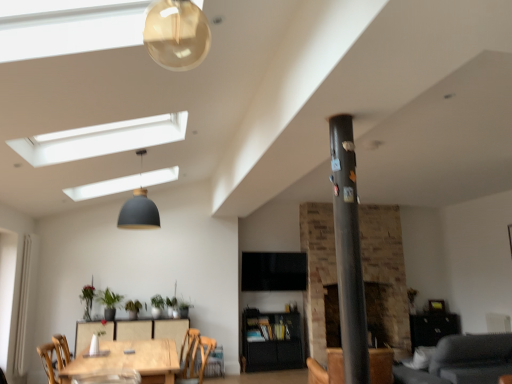
Question: From the image's perspective, is metallic gray pole at center on gray fabric couch at lower right?

Choices:
 (A) no
 (B) yes

Answer: (B)

Question: From the image's perspective, would you say metallic gray pole at center is shown under gray fabric couch at lower right?

Choices:
 (A) yes
 (B) no

Answer: (B)

Question: Can gray fabric couch at lower right be found inside metallic gray pole at center?

Choices:
 (A) no
 (B) yes

Answer: (A)

Question: Can you confirm if metallic gray pole at center is positioned to the right of gray fabric couch at lower right?

Choices:
 (A) yes
 (B) no

Answer: (B)

Question: Is metallic gray pole at center taller than gray fabric couch at lower right?

Choices:
 (A) yes
 (B) no

Answer: (A)

Question: From a real-world perspective, does metallic gray pole at center sit lower than gray fabric couch at lower right?

Choices:
 (A) no
 (B) yes

Answer: (A)

Question: Does green matte plant at lower left, positioned as the second plant in left-to-right order, appear on the right side of matte black pendant lamp at upper center?

Choices:
 (A) no
 (B) yes

Answer: (A)

Question: Is green matte plant at lower left, acting as the 3th plant starting from the right, oriented away from matte black pendant lamp at upper center?

Choices:
 (A) yes
 (B) no

Answer: (B)

Question: Is green matte plant at lower left, positioned as the second plant in left-to-right order, behind matte black pendant lamp at upper center?

Choices:
 (A) yes
 (B) no

Answer: (A)

Question: Does green matte plant at lower left, positioned as the second plant in left-to-right order, have a greater height compared to matte black pendant lamp at upper center?

Choices:
 (A) yes
 (B) no

Answer: (B)

Question: Can you confirm if green matte plant at lower left, acting as the 3th plant starting from the right, is bigger than matte black pendant lamp at upper center?

Choices:
 (A) yes
 (B) no

Answer: (B)

Question: Considering the relative sizes of green matte plant at lower left, acting as the 3th plant starting from the right, and matte black pendant lamp at upper center in the image provided, is green matte plant at lower left, acting as the 3th plant starting from the right, thinner than matte black pendant lamp at upper center?

Choices:
 (A) no
 (B) yes

Answer: (B)

Question: Are green leafy plant at center, which ranks as the second plant in right-to-left order, and brown leather armchair at center beside each other?

Choices:
 (A) yes
 (B) no

Answer: (B)